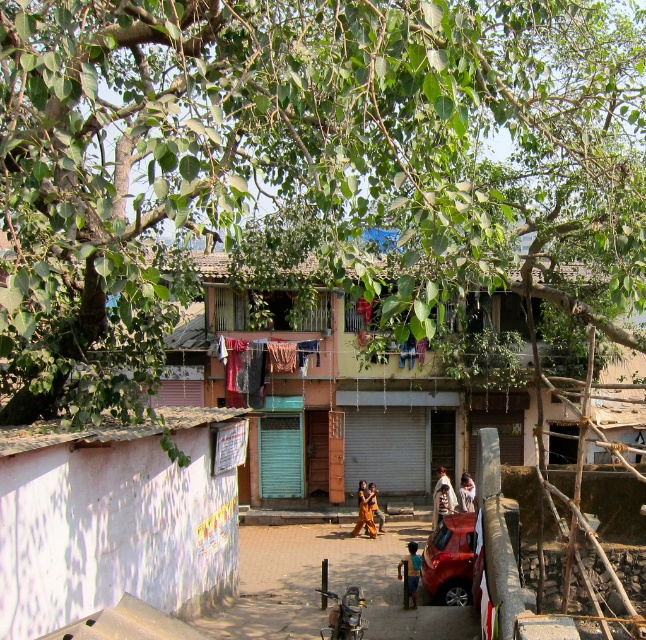
You are a delivery person who needs to park your metallic silver motorcycle at lower center near the light brown wooden hut at center. Is there enough space between them to park the motorcycle without moving the hut?

The light brown wooden hut at center and metallic silver motorcycle at lower center are 35.86 feet apart, so there is sufficient space to park the metallic silver motorcycle at lower center near the light brown wooden hut at center without moving the hut.

You are standing at the point closest to the two points in the image, which are labeled as point (x=360, y=632) and point (x=368, y=504). Which point is closer to you?

Point (x=360, y=632) is in front of point (x=368, y=504), so it is closer to you.

You are standing at the center of the street and want to reach the light brown wooden hut at center. According to the coordinates provided, in which direction should you walk to reach it?

The light brown wooden hut at center is located at coordinates point (331, 401), so you should walk towards the center of the image to reach it.